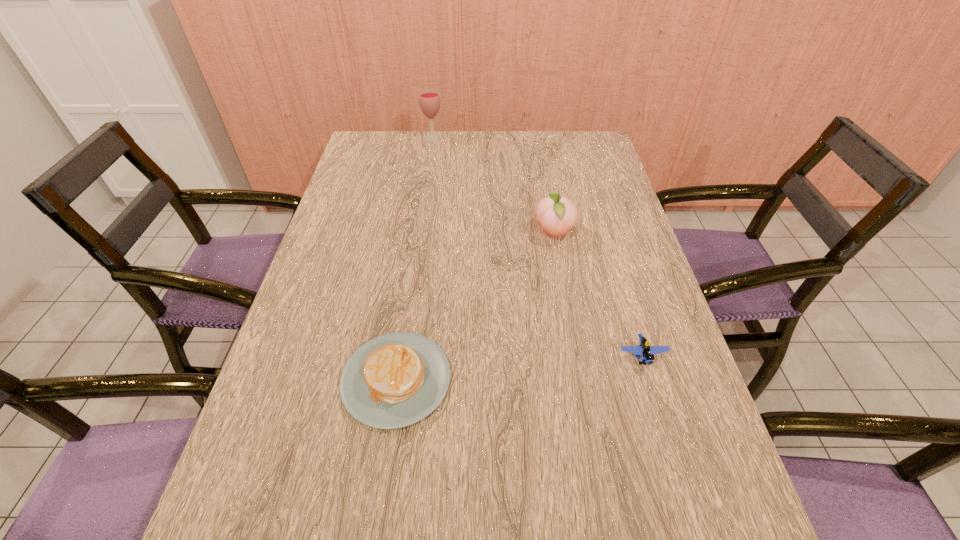
Where is `free space between the pancake and the farthest object`? This screenshot has height=540, width=960. free space between the pancake and the farthest object is located at coordinates (415, 259).

Find the location of a particular element. The image size is (960, 540). vacant point located between the second object from right to left and the tallest object is located at coordinates (493, 186).

You are a GUI agent. You are given a task and a screenshot of the screen. Output one action in this format:
    pyautogui.click(x=<x>, y=<y>)
    Task: Click on the vacant space in between the tallest object and the peach
    The width and height of the screenshot is (960, 540).
    Given the screenshot: What is the action you would take?
    pyautogui.click(x=493, y=186)

Where is `empty location between the tallest object and the rightmost object`? This screenshot has width=960, height=540. empty location between the tallest object and the rightmost object is located at coordinates tap(538, 247).

Image resolution: width=960 pixels, height=540 pixels. Identify the location of vacant area that lies between the farthest object and the third object from left to right. (493, 186).

Locate an element on the screen. free spot between the second farthest object and the Lego is located at coordinates (598, 295).

Image resolution: width=960 pixels, height=540 pixels. What are the coordinates of `vacant region between the peach and the rightmost object` in the screenshot? It's located at (598, 295).

Image resolution: width=960 pixels, height=540 pixels. I want to click on object that is the closest to the tallest object, so click(557, 215).

You are a GUI agent. You are given a task and a screenshot of the screen. Output one action in this format:
    pyautogui.click(x=<x>, y=<y>)
    Task: Click on the object identified as the third closest to the rightmost object
    The height and width of the screenshot is (540, 960).
    Given the screenshot: What is the action you would take?
    pyautogui.click(x=429, y=100)

Where is `blank area in the image that satisfies the following two spatial constraints: 1. on the front side of the peach; 2. on the right side of the farthest object`? blank area in the image that satisfies the following two spatial constraints: 1. on the front side of the peach; 2. on the right side of the farthest object is located at coordinates (419, 234).